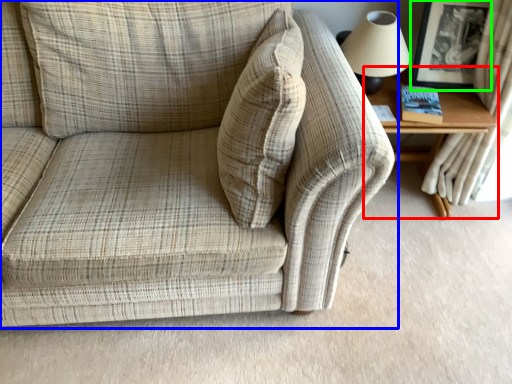
Question: Based on their relative distances, which object is nearer to table (highlighted by a red box)? Choose from studio couch (highlighted by a blue box) and picture frame (highlighted by a green box).

Choices:
 (A) studio couch
 (B) picture frame

Answer: (B)